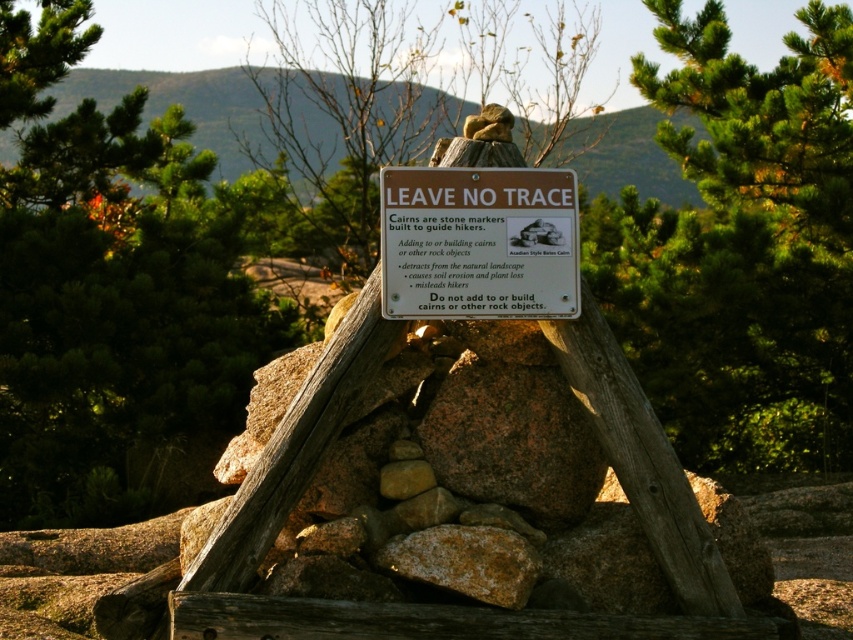
Question: Among these points, which one is farthest from the camera?

Choices:
 (A) (438, 307)
 (B) (751, 244)

Answer: (B)

Question: Does green leafy tree at upper right appear over brown paper sign at center?

Choices:
 (A) yes
 (B) no

Answer: (A)

Question: Among these points, which one is nearest to the camera?

Choices:
 (A) (381, 220)
 (B) (737, 376)

Answer: (A)

Question: Which point is closer to the camera?

Choices:
 (A) green leafy tree at upper right
 (B) brown paper sign at center

Answer: (B)

Question: Is green leafy tree at upper right positioned before brown paper sign at center?

Choices:
 (A) yes
 (B) no

Answer: (B)

Question: Can you confirm if green leafy tree at upper right is positioned to the right of brown paper sign at center?

Choices:
 (A) yes
 (B) no

Answer: (A)